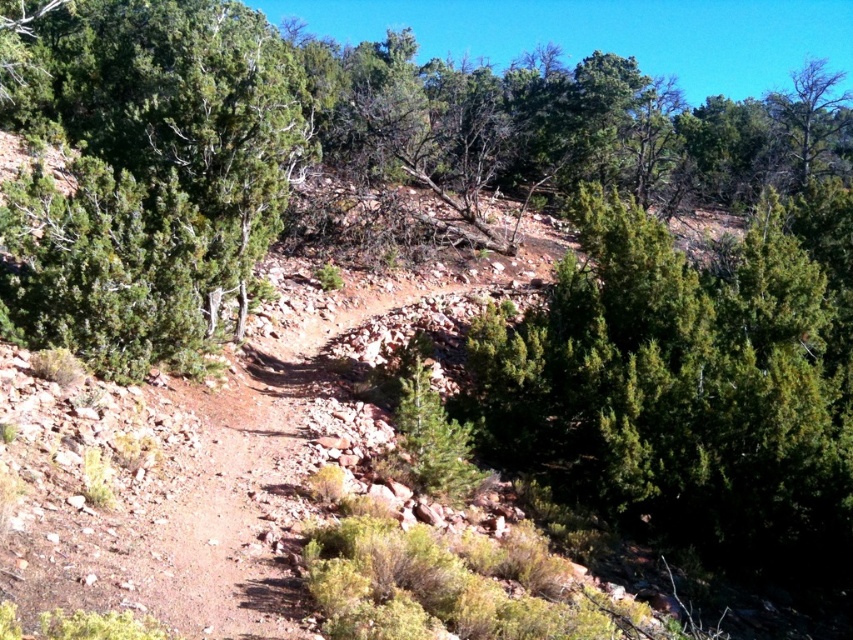
The height and width of the screenshot is (640, 853). Describe the element at coordinates (387, 120) in the screenshot. I see `green textured bush at center` at that location.

This screenshot has width=853, height=640. Identify the location of green textured bush at center. (387, 120).

Is green needle-like at right positioned before green needle-like at left?

That is False.

Is point (753, 554) positioned in front of point (56, 289)?

No, (753, 554) is further to viewer.

Find the location of a particular element. This screenshot has height=640, width=853. green needle-like at right is located at coordinates (682, 388).

Who is more forward, (149, 68) or (256, 35)?

Point (149, 68) is more forward.

In the scene shown: Can you confirm if green textured bush at center is bigger than green needle-like at left?

Yes, green textured bush at center is bigger than green needle-like at left.

The height and width of the screenshot is (640, 853). I want to click on green textured bush at center, so click(387, 120).